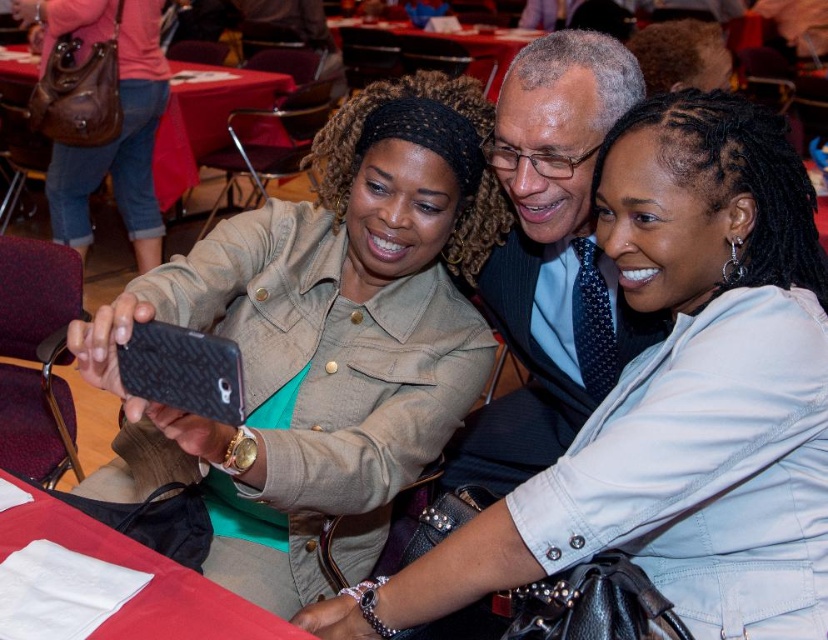
Between matte khaki jacket at center and red fabric table at lower left, which one has less height?

Standing shorter between the two is red fabric table at lower left.

Between point (379, 157) and point (84, 515), which one is positioned behind?

The point (379, 157) is more distant.

Locate an element on the screen. The height and width of the screenshot is (640, 828). matte khaki jacket at center is located at coordinates (319, 342).

Does polished dark blue tie at center appear on the right side of brown leather purse at upper left?

Correct, you'll find polished dark blue tie at center to the right of brown leather purse at upper left.

How far apart are polished dark blue tie at center and brown leather purse at upper left?

polished dark blue tie at center and brown leather purse at upper left are 2.36 meters apart.

Which is behind, point (663, 326) or point (78, 176)?

Point (78, 176)

Find the location of a particular element. polished dark blue tie at center is located at coordinates (550, 259).

Between red fabric table at upper left and red cloth table at center, which one has less height?

red cloth table at center is shorter.

Between red fabric table at upper left and red cloth table at center, which one has more height?

red fabric table at upper left

What are the coordinates of `red fabric table at upper left` in the screenshot? It's located at (203, 118).